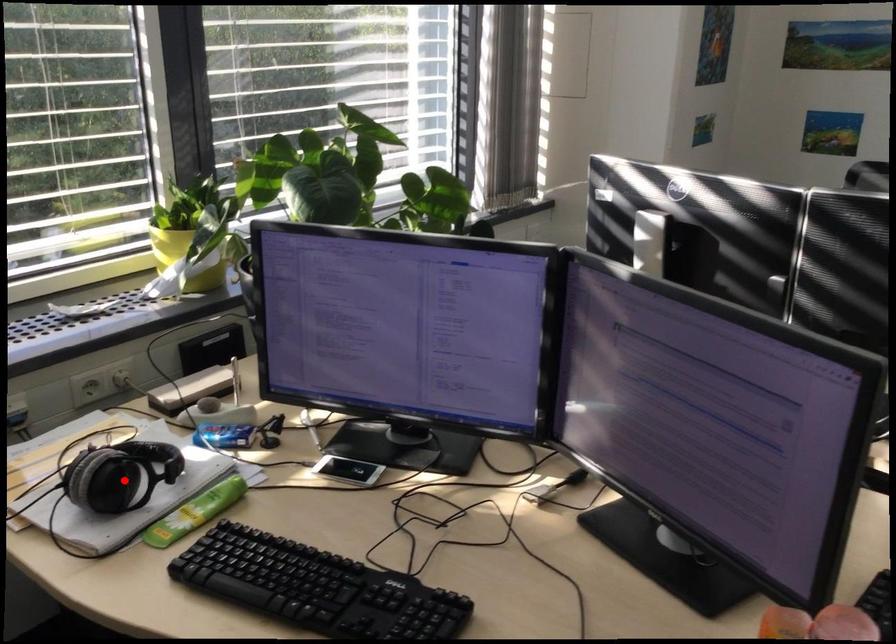
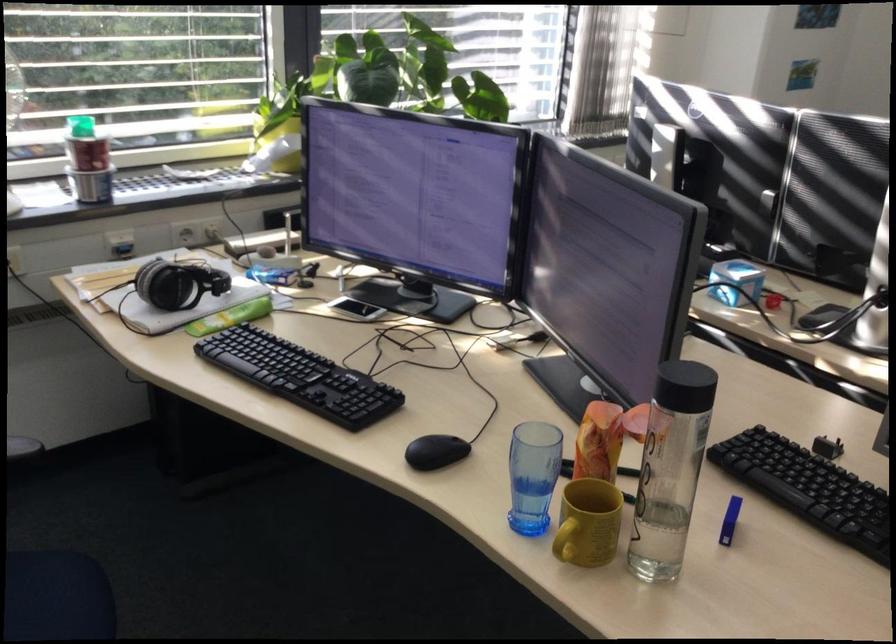
Question: A red point is marked in image1. In image2, is the corresponding 3D point closer to the camera or farther? Reply with the corresponding letter.

Choices:
 (A) The corresponding 3D point is closer.
 (B) The corresponding 3D point is farther.

Answer: (B)